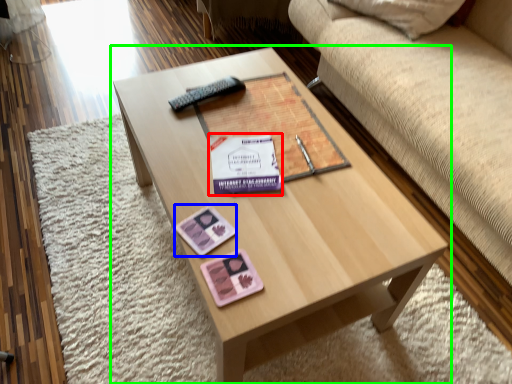
Question: Based on their relative distances, which object is nearer to paperback book (highlighted by a red box)? Choose from currency (highlighted by a blue box) and coffee table (highlighted by a green box).

Choices:
 (A) currency
 (B) coffee table

Answer: (A)